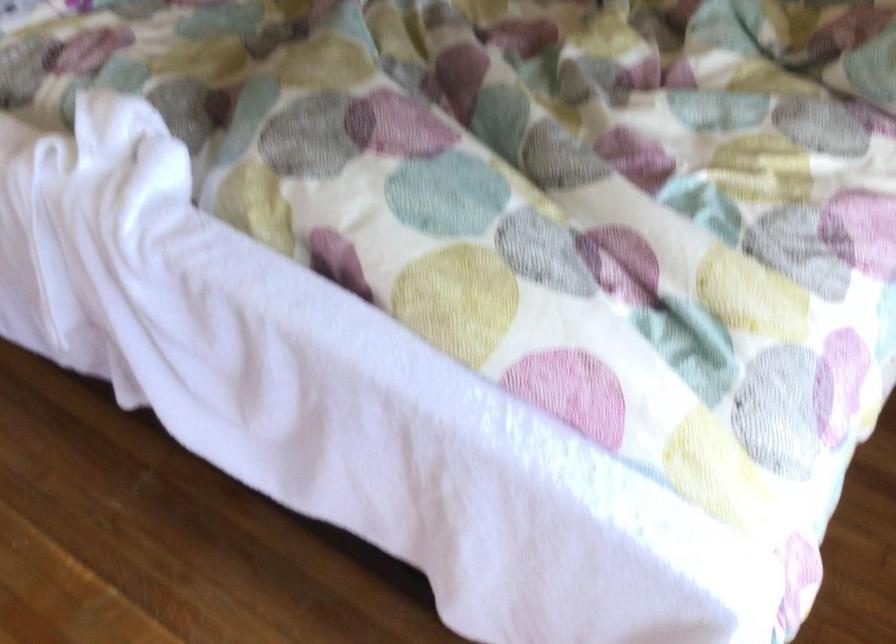
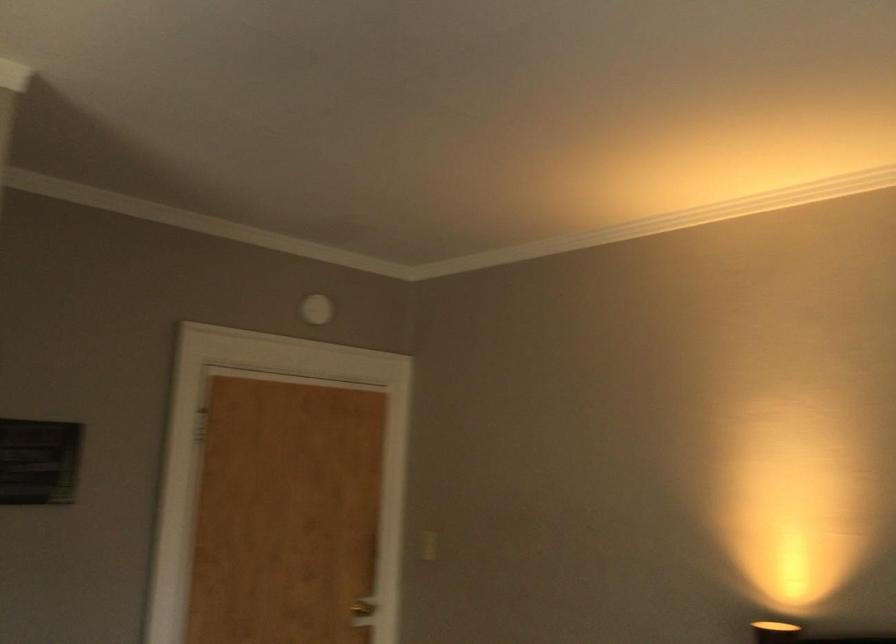
Consider the image. The images are taken continuously from a first-person perspective. In which direction is your viewpoint rotating?

The camera rotated toward left-up.